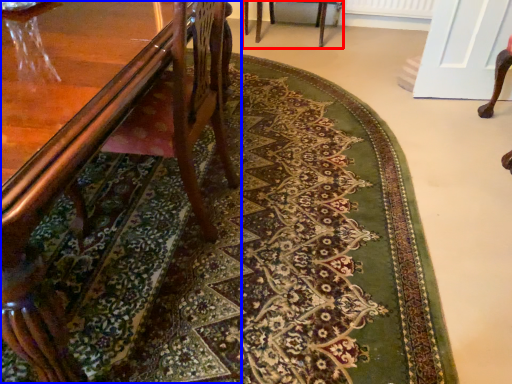
Question: Which object appears closest to the camera in this image, chair (highlighted by a red box) or chair (highlighted by a blue box)?

Choices:
 (A) chair
 (B) chair

Answer: (B)